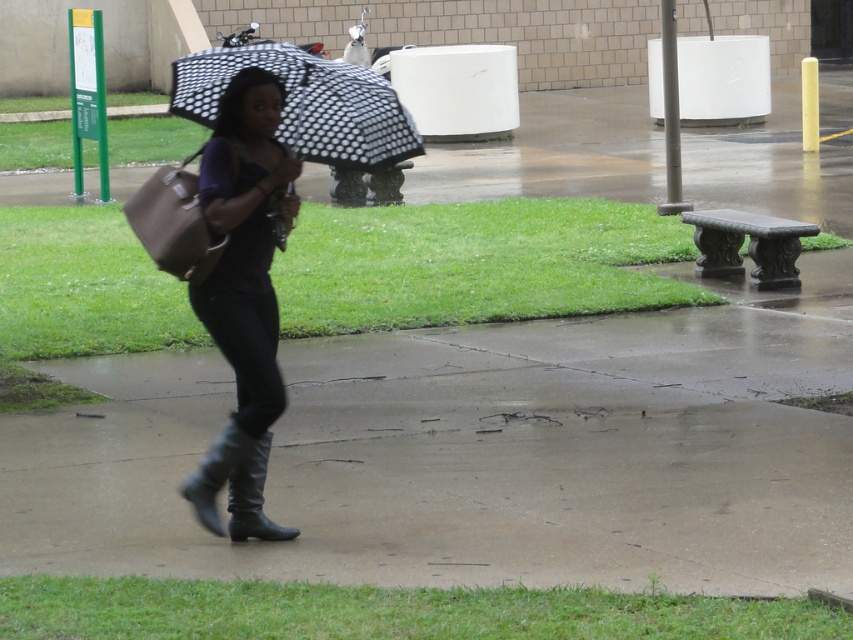
Between black leather boot at lower center and leather high-heeled boot at center, which one is positioned higher?

Positioned higher is leather high-heeled boot at center.

Which of these two, black leather boot at lower center or leather high-heeled boot at center, stands taller?

Standing taller between the two is leather high-heeled boot at center.

Who is more distant from viewer, (242, 477) or (181, 486)?

Point (181, 486)

Where is `black leather boot at lower center`? Image resolution: width=853 pixels, height=640 pixels. black leather boot at lower center is located at coordinates (252, 497).

Based on the photo, can you confirm if matte black boots at center is shorter than polka dot fabric umbrella at center?

Incorrect, matte black boots at center's height does not fall short of polka dot fabric umbrella at center's.

Is point (250, 374) more distant than point (322, 129)?

No, (250, 374) is closer to viewer.

Find the location of a particular element. Image resolution: width=853 pixels, height=640 pixels. matte black boots at center is located at coordinates (242, 296).

Locate an element on the screen. matte black boots at center is located at coordinates (242, 296).

Is the position of polka dot fabric umbrella at center more distant than that of leather high-heeled boot at center?

Yes, polka dot fabric umbrella at center is further from the viewer.

Can you confirm if polka dot fabric umbrella at center is positioned above leather high-heeled boot at center?

Indeed, polka dot fabric umbrella at center is positioned over leather high-heeled boot at center.

Locate an element on the screen. polka dot fabric umbrella at center is located at coordinates (306, 104).